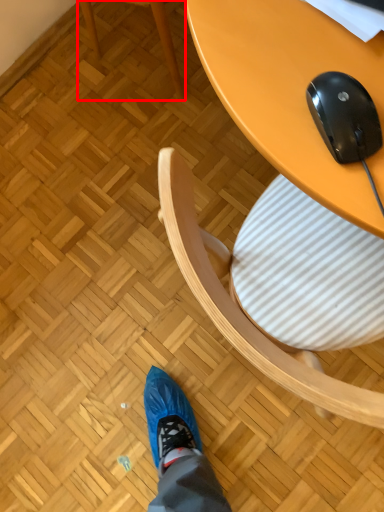
Question: From the image's perspective, what is the correct spatial relationship of chair (annotated by the red box) in relation to mouse?

Choices:
 (A) above
 (B) below

Answer: (A)